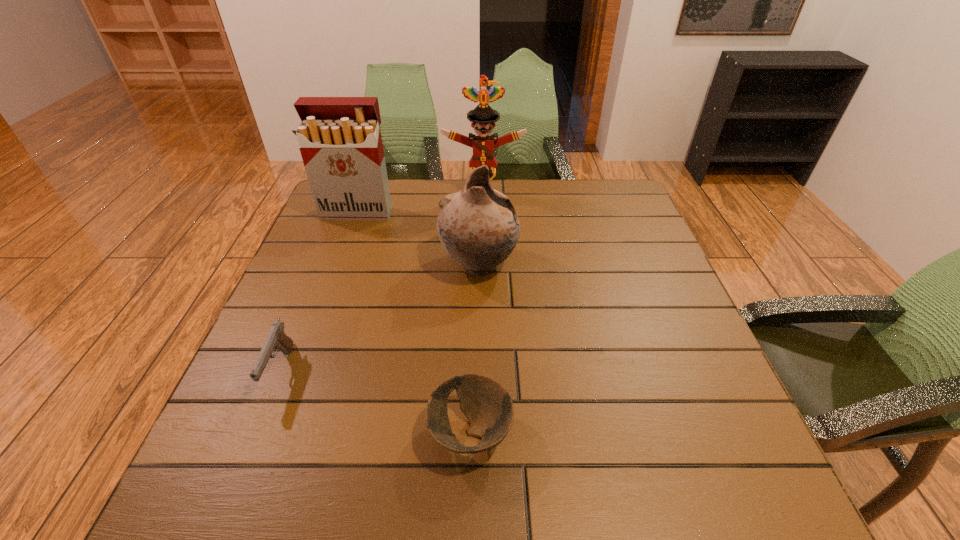
You are a GUI agent. You are given a task and a screenshot of the screen. Output one action in this format:
    pyautogui.click(x=<x>, y=<y>)
    Task: Click on the vacant space at the right edge of the desktop
    The image size is (960, 540).
    Given the screenshot: What is the action you would take?
    pyautogui.click(x=682, y=376)

At what (x,y) coordinates should I click in order to perform the action: click on blank space at the near left corner of the desktop. Please return your answer as a coordinate pair (x, y). Looking at the image, I should click on (196, 478).

Identify the location of vacant region at the far right corner of the desktop. (589, 219).

This screenshot has width=960, height=540. I want to click on vacant space at the near right corner, so click(x=748, y=487).

Where is `blank region between the bowl and the second shortest object`? blank region between the bowl and the second shortest object is located at coordinates (375, 402).

Find the location of a particular element. The height and width of the screenshot is (540, 960). free space between the farthest object and the shortest object is located at coordinates (477, 314).

This screenshot has height=540, width=960. I want to click on free space between the nutcracker and the shortest object, so click(x=477, y=314).

Where is `empty space that is in between the nutcracker and the second farthest object`? empty space that is in between the nutcracker and the second farthest object is located at coordinates (420, 204).

Image resolution: width=960 pixels, height=540 pixels. What are the coordinates of `vacant point located between the pistol and the cigarette case` in the screenshot? It's located at (319, 291).

Find the location of a particular element. empty location between the second shortest object and the bowl is located at coordinates (375, 402).